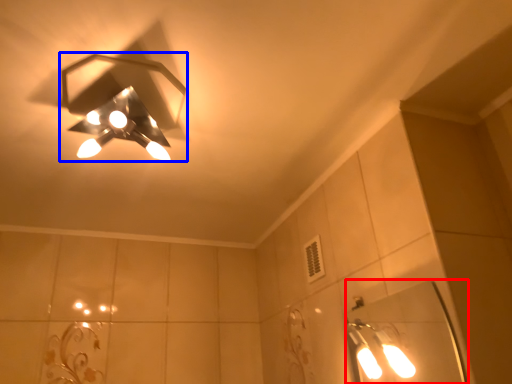
Question: Which object appears closest to the camera in this image, mirror (highlighted by a red box) or lamp (highlighted by a blue box)?

Choices:
 (A) mirror
 (B) lamp

Answer: (B)